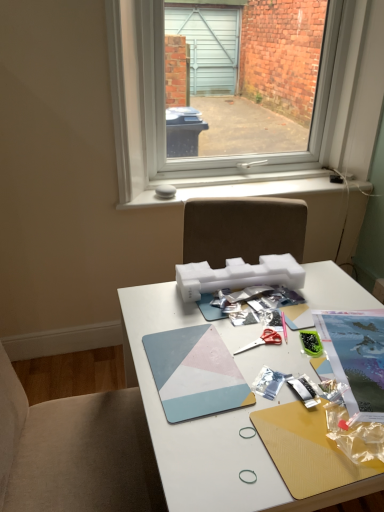
The image size is (384, 512). Find the location of `vacant space that's between geometric matte mousepad at center, acting as the 2th magazine starting from the right, and red plastic scissors at center`. vacant space that's between geometric matte mousepad at center, acting as the 2th magazine starting from the right, and red plastic scissors at center is located at coordinates tap(247, 349).